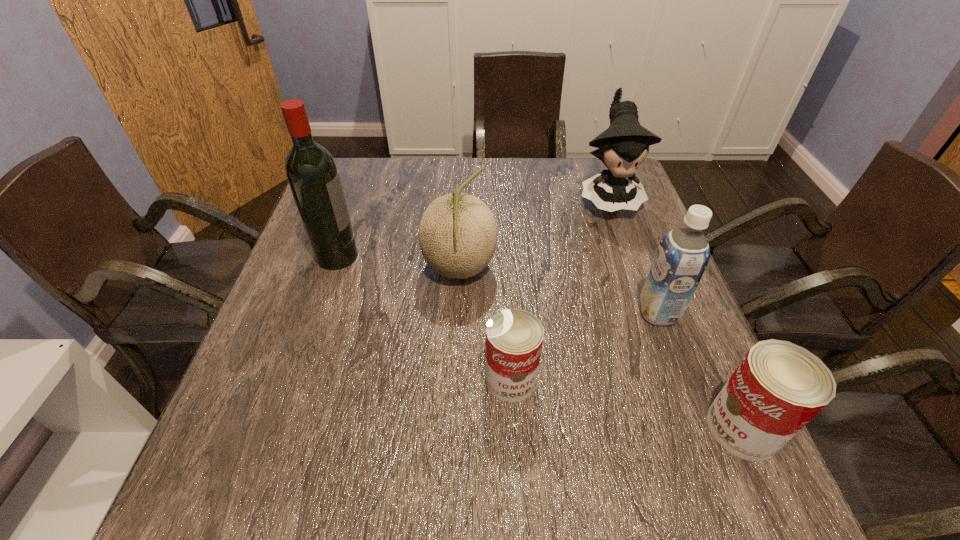
At what (x,y) coordinates should I click in order to perform the action: click on vacant space located 0.290m on the front label of the right can. Please return your answer as a coordinate pair (x, y). Looking at the image, I should click on (546, 428).

Where is `vacant region located on the front label of the right can`? Image resolution: width=960 pixels, height=540 pixels. vacant region located on the front label of the right can is located at coordinates (540, 428).

Where is `vacant space located 0.140m on the front label of the right can`? vacant space located 0.140m on the front label of the right can is located at coordinates (631, 428).

Find the location of a particular element. This screenshot has width=960, height=540. vacant space located 0.200m at the face of the doll is located at coordinates (636, 276).

Find the location of a particular element. Image resolution: width=960 pixels, height=540 pixels. vacant space situated on the right of the cantaloup is located at coordinates (534, 269).

Where is `vacant space located 0.240m on the label of the tallest object`? vacant space located 0.240m on the label of the tallest object is located at coordinates (454, 256).

Identify the location of free space located on the label of the soya milk. (608, 313).

At what (x,y) coordinates should I click in order to perform the action: click on free space located 0.170m on the label of the soya milk. Please return your answer as a coordinate pair (x, y). Looking at the image, I should click on (563, 313).

This screenshot has width=960, height=540. Identify the location of free location located on the label of the soya milk. (567, 313).

At what (x,y) coordinates should I click in order to perform the action: click on object that is at the far edge. Please return your answer as a coordinate pair (x, y). Looking at the image, I should click on (624, 146).